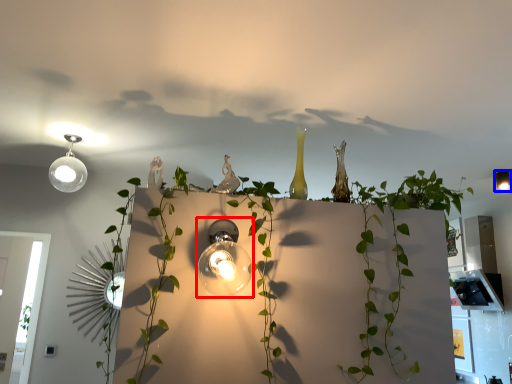
Question: Among these objects, which one is farthest to the camera, lamp (highlighted by a red box) or lamp (highlighted by a blue box)?

Choices:
 (A) lamp
 (B) lamp

Answer: (B)